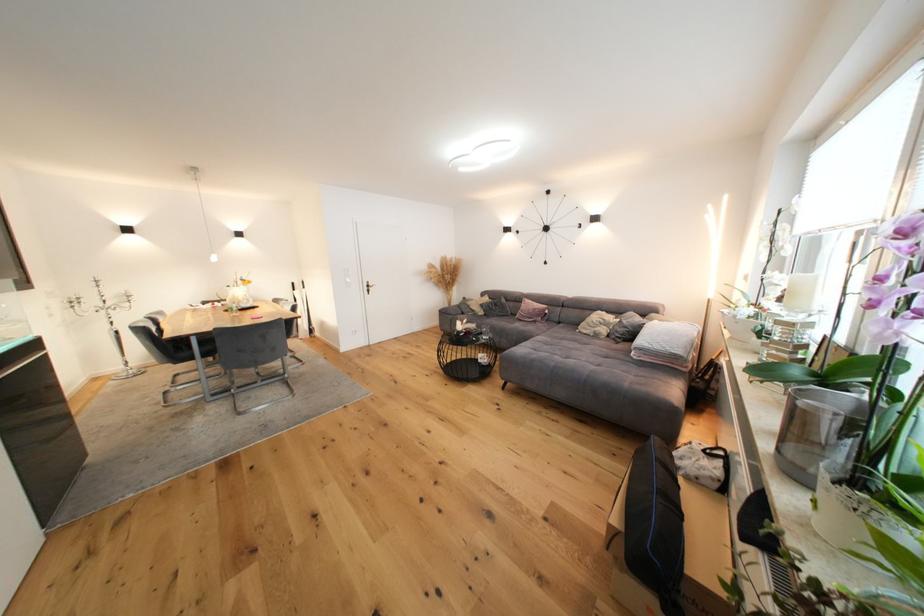
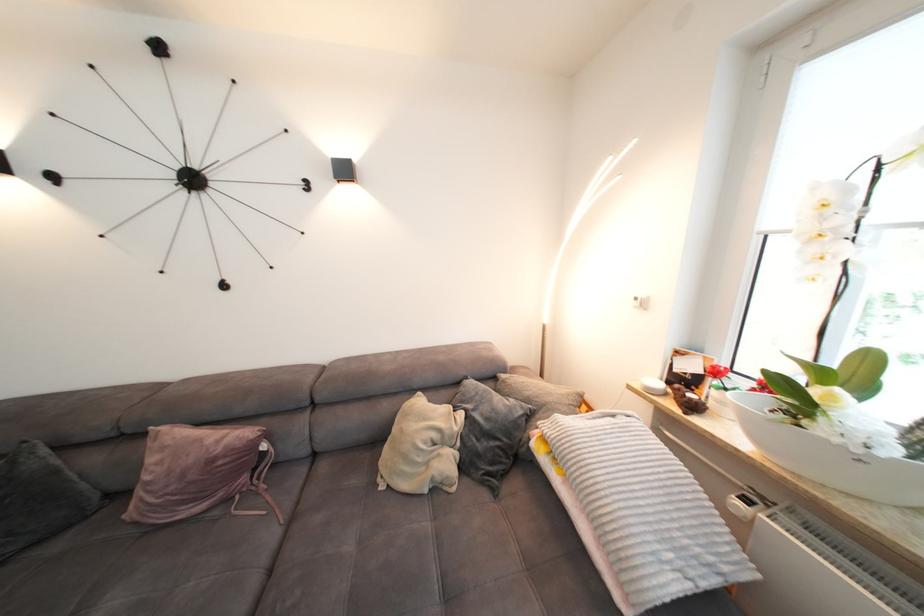
Find the pixel in the second image that matches [568,326] in the first image.

(330, 469)